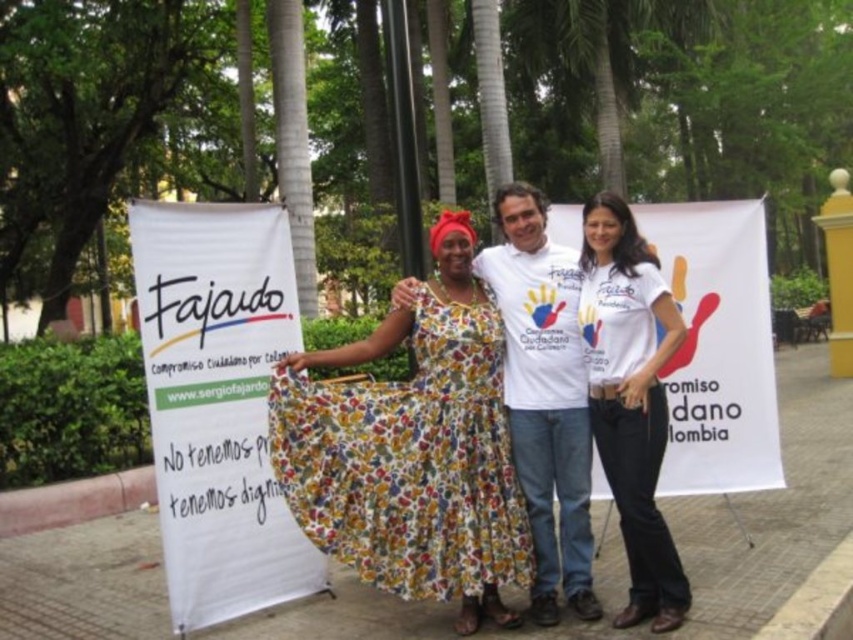
In the scene shown: How far apart are floral cotton dress at center and white cotton t-shirt at center?

floral cotton dress at center is 32.30 inches away from white cotton t-shirt at center.

Can you confirm if floral cotton dress at center is bigger than white cotton t-shirt at center?

No, floral cotton dress at center is not bigger than white cotton t-shirt at center.

This screenshot has width=853, height=640. What do you see at coordinates (409, 461) in the screenshot? I see `floral cotton dress at center` at bounding box center [409, 461].

Identify the location of floral cotton dress at center. (409, 461).

How distant is white fabric banner at left from white t-shirt at center?

white fabric banner at left is 1.38 meters away from white t-shirt at center.

Which is above, white fabric banner at left or white t-shirt at center?

white t-shirt at center is higher up.

Who is more forward, (193,221) or (537,502)?

Point (537,502)

Where is `white fabric banner at left`? The image size is (853, 640). white fabric banner at left is located at coordinates (218, 403).

Between white fabric banner at left and floral cotton dress at center, which one has more height?

white fabric banner at left

Locate an element on the screen. white fabric banner at left is located at coordinates (218, 403).